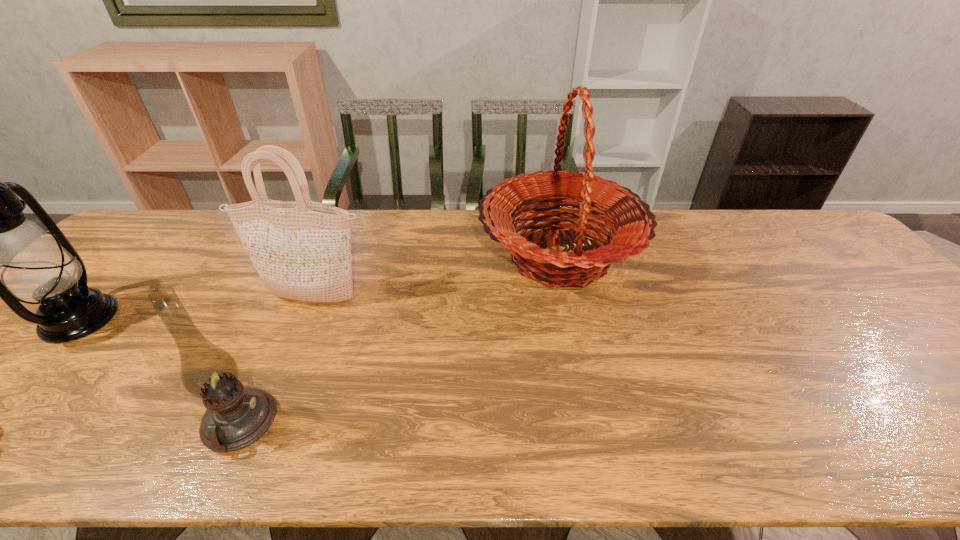
You are a GUI agent. You are given a task and a screenshot of the screen. Output one action in this format:
    pyautogui.click(x=<x>, y=<y>)
    Task: Click on the object that is positioned at the far edge
    
    Given the screenshot: What is the action you would take?
    click(x=628, y=217)

I want to click on object that is positioned at the near edge, so click(236, 416).

You are a GUI agent. You are given a task and a screenshot of the screen. Output one action in this format:
    pyautogui.click(x=<x>, y=<y>)
    Task: Click on the object that is at the left edge
    
    Given the screenshot: What is the action you would take?
    pyautogui.click(x=0, y=243)

You are a GUI agent. You are given a task and a screenshot of the screen. Output one action in this format:
    pyautogui.click(x=<x>, y=<y>)
    Task: Click on the vacant space at the far edge of the desktop
    
    Given the screenshot: What is the action you would take?
    pyautogui.click(x=694, y=248)

Locate an element on the screen. The image size is (960, 540). vacant space at the near edge is located at coordinates (221, 456).

Find the location of a particular element. The height and width of the screenshot is (540, 960). free region at the left edge of the desktop is located at coordinates (22, 394).

Where is `vacant space at the right edge of the desktop`? This screenshot has width=960, height=540. vacant space at the right edge of the desktop is located at coordinates (843, 256).

I want to click on vacant space at the far left corner of the desktop, so click(x=170, y=247).

Find the location of a particular element. unoccupied area between the shopping bag and the basket is located at coordinates (437, 278).

Find the location of a particular element. The image size is (960, 540). empty space that is in between the rightmost object and the nearer oil lamp is located at coordinates (399, 340).